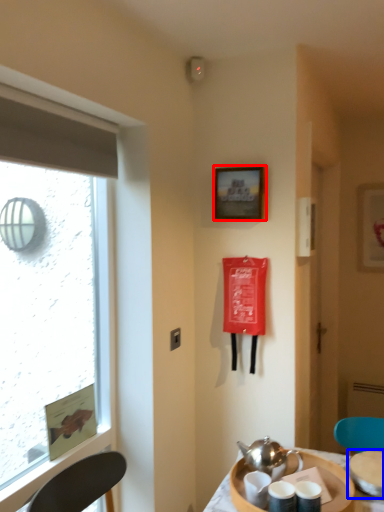
Question: Which object is closer to the camera taking this photo, picture frame (highlighted by a red box) or tableware (highlighted by a blue box)?

Choices:
 (A) picture frame
 (B) tableware

Answer: (B)